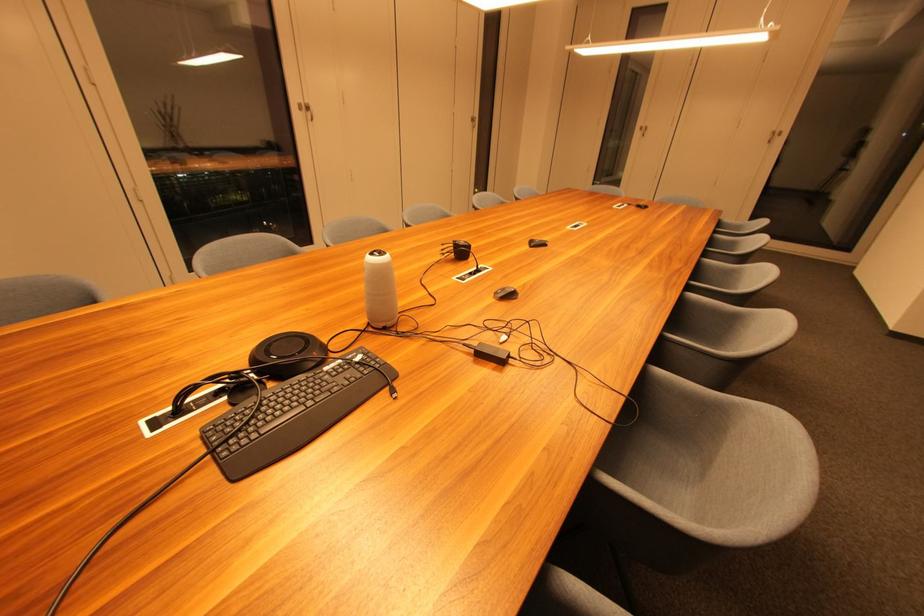
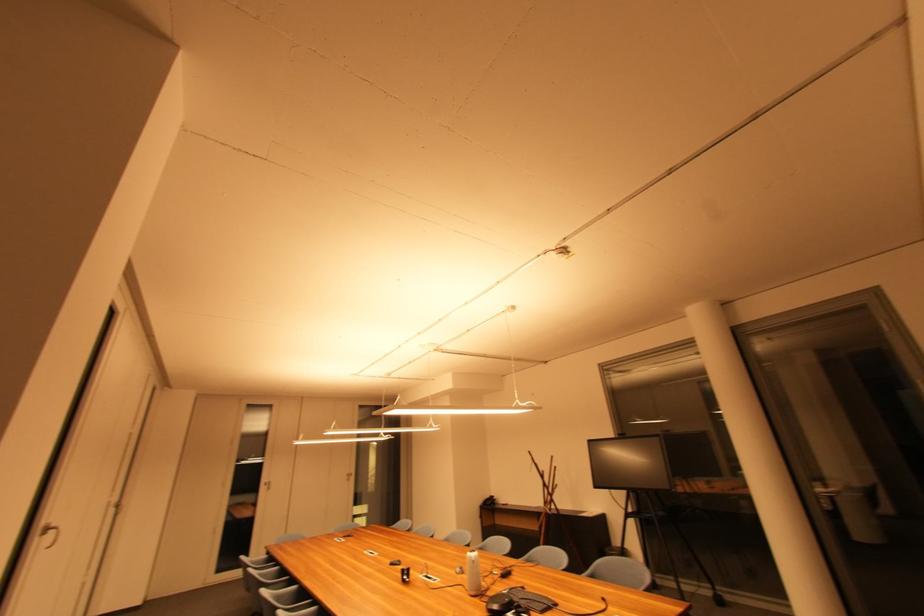
Locate, in the second image, the point that corresponds to point (646, 130) in the first image.

(271, 485)